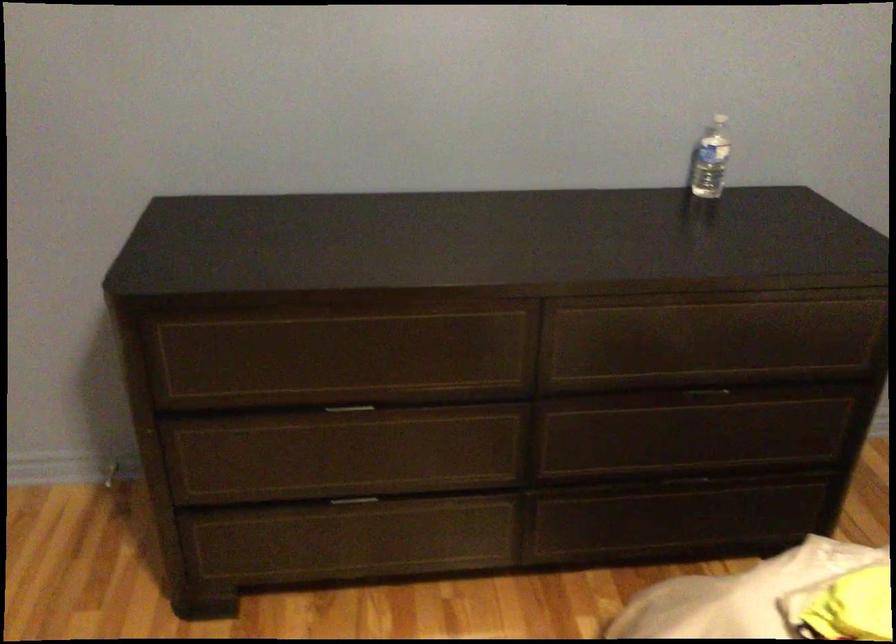
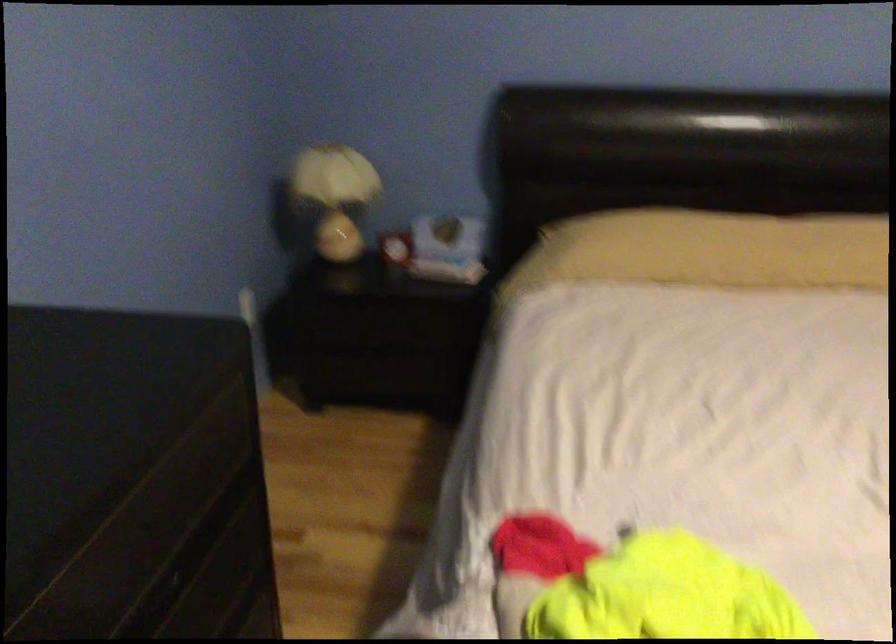
Locate, in the second image, the point that corresponds to the point at 771,381 in the first image.

(186, 559)